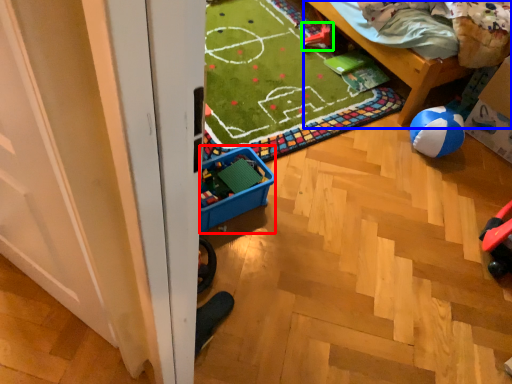
Question: Considering the real-world distances, which object is closest to storage box (highlighted by a red box)? furniture (highlighted by a blue box) or toy (highlighted by a green box).

Choices:
 (A) furniture
 (B) toy

Answer: (A)